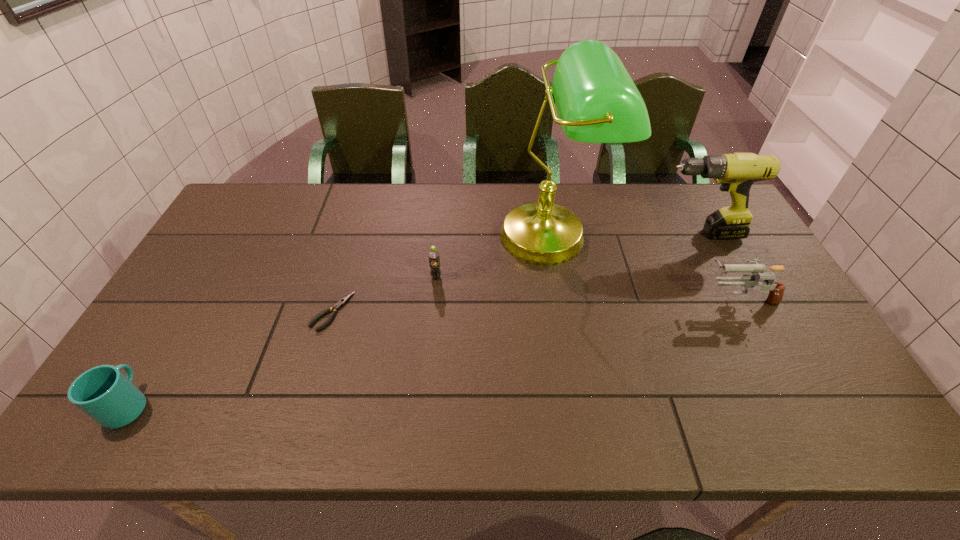
I want to click on free point at the right edge, so click(x=821, y=354).

Identify the location of free space at the far left corner of the desktop. (265, 214).

In the image, there is a desktop. Where is `free space at the far right corner`? free space at the far right corner is located at coordinates (704, 216).

Locate an element on the screen. The height and width of the screenshot is (540, 960). free spot between the fifth object from right to left and the lamp is located at coordinates [x=443, y=274].

This screenshot has width=960, height=540. In order to click on vacant area that lies between the fourth object from left to right and the pliers in this screenshot , I will do `click(443, 274)`.

You are a GUI agent. You are given a task and a screenshot of the screen. Output one action in this format:
    pyautogui.click(x=<x>, y=<y>)
    Task: Click on the free space between the cup and the fourth object from left to right
    
    Given the screenshot: What is the action you would take?
    point(341,320)

Where is `free point between the lamp and the pliers`? The width and height of the screenshot is (960, 540). free point between the lamp and the pliers is located at coordinates (443, 274).

The height and width of the screenshot is (540, 960). Identify the location of vacant point located between the second tallest object and the cup. (413, 319).

Locate an element on the screen. The width and height of the screenshot is (960, 540). unoccupied area between the nearest object and the fourth object from right to left is located at coordinates (282, 341).

This screenshot has width=960, height=540. I want to click on blank region between the cup and the gun, so coord(434,351).